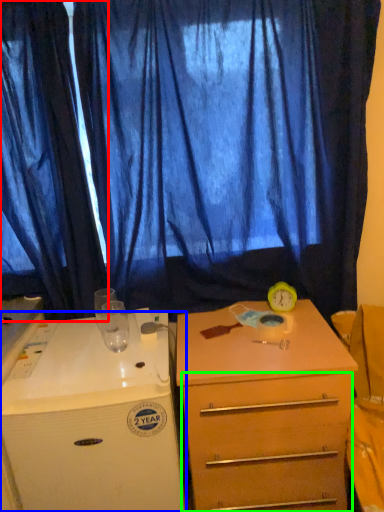
Question: Estimate the real-world distances between objects in this image. Which object is farther from curtain (highlighted by a red box), desk (highlighted by a blue box) or drawer (highlighted by a green box)?

Choices:
 (A) desk
 (B) drawer

Answer: (B)